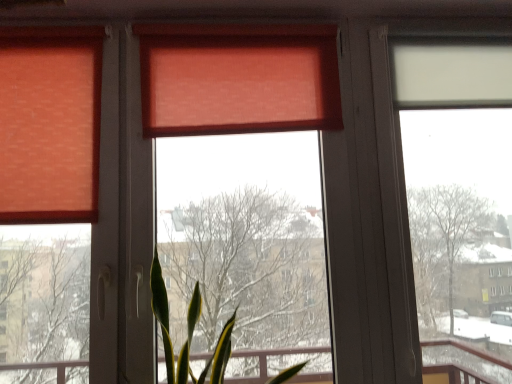
Question: Which direction should I rotate to face matte orange window screen at center, which is the second window screen from right to left, — up or down?

Choices:
 (A) up
 (B) down

Answer: (B)

Question: Would you say transparent plastic window screen at right, which is the 2th window screen from left to right, is outside matte orange curtain at upper center?

Choices:
 (A) no
 (B) yes

Answer: (B)

Question: From a real-world perspective, is transparent plastic window screen at right, which is the 1th window screen from right to left, over matte orange curtain at upper center?

Choices:
 (A) no
 (B) yes

Answer: (A)

Question: From the image's perspective, is transparent plastic window screen at right, which is the 1th window screen from right to left, on top of matte orange curtain at upper center?

Choices:
 (A) yes
 (B) no

Answer: (B)

Question: Is matte orange curtain at upper center at the back of transparent plastic window screen at right, which is the 2th window screen from left to right?

Choices:
 (A) yes
 (B) no

Answer: (B)

Question: Is transparent plastic window screen at right, which is the 1th window screen from right to left, bigger than matte orange curtain at upper center?

Choices:
 (A) no
 (B) yes

Answer: (A)

Question: From a real-world perspective, is transparent plastic window screen at right, which is the 1th window screen from right to left, positioned under matte orange curtain at upper center based on gravity?

Choices:
 (A) no
 (B) yes

Answer: (B)

Question: Is matte orange window screen at center, which is the 1th window screen from left to right, located outside matte orange curtain at upper center?

Choices:
 (A) yes
 (B) no

Answer: (A)

Question: Does matte orange window screen at center, which is the second window screen from right to left, turn towards matte orange curtain at upper center?

Choices:
 (A) yes
 (B) no

Answer: (A)

Question: Is matte orange window screen at center, which is the 1th window screen from left to right, next to matte orange curtain at upper center and touching it?

Choices:
 (A) no
 (B) yes

Answer: (B)

Question: Is matte orange window screen at center, which is the 1th window screen from left to right, at the right side of matte orange curtain at upper center?

Choices:
 (A) no
 (B) yes

Answer: (B)

Question: Is matte orange window screen at center, which is the 1th window screen from left to right, positioned in front of matte orange curtain at upper center?

Choices:
 (A) yes
 (B) no

Answer: (A)

Question: Is matte orange window screen at center, which is the second window screen from right to left, bigger than matte orange curtain at upper center?

Choices:
 (A) yes
 (B) no

Answer: (A)

Question: Could you tell me if matte orange curtain at upper center is turned towards transparent plastic window screen at right, which is the 1th window screen from right to left?

Choices:
 (A) yes
 (B) no

Answer: (B)